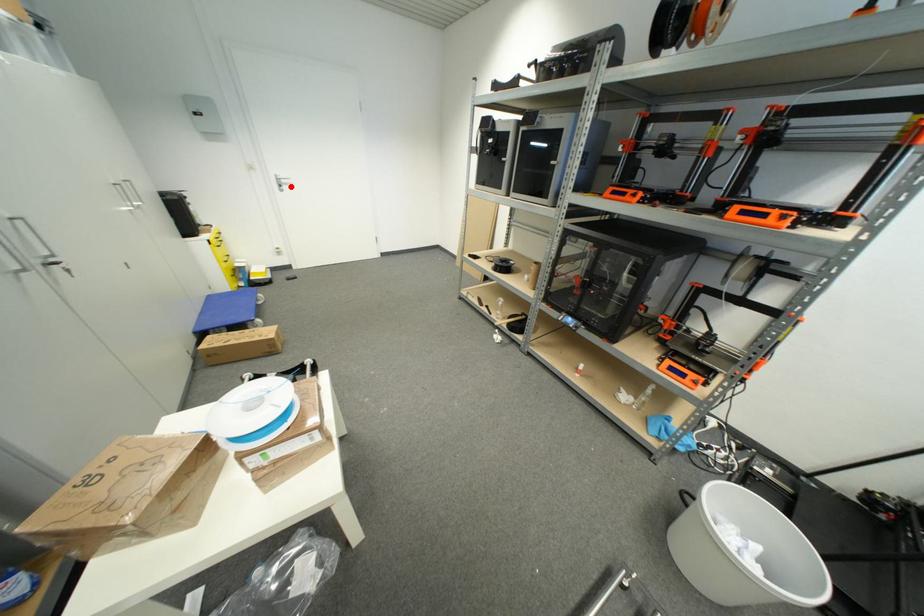
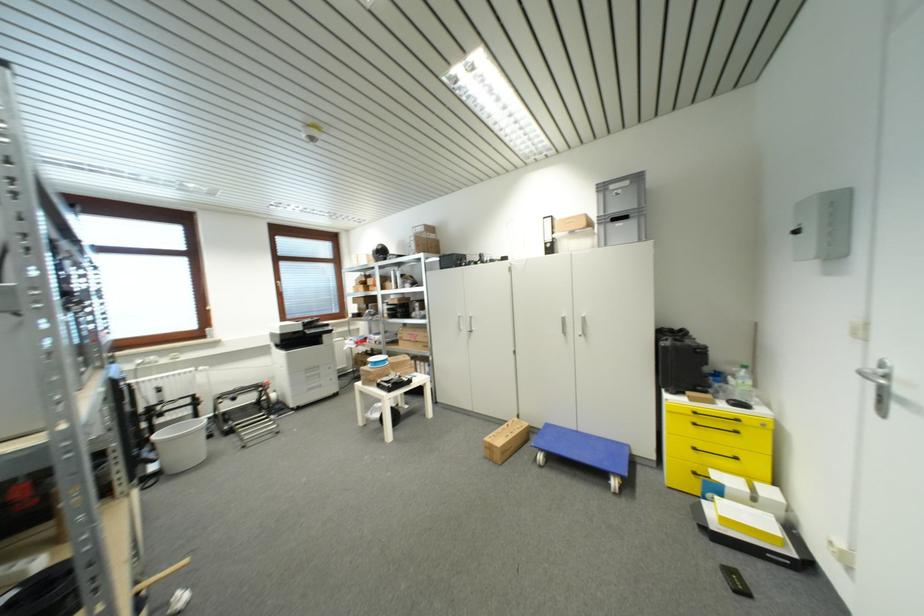
Where in the second image is the point corresponding to the highlighted location from the first image?

(909, 405)